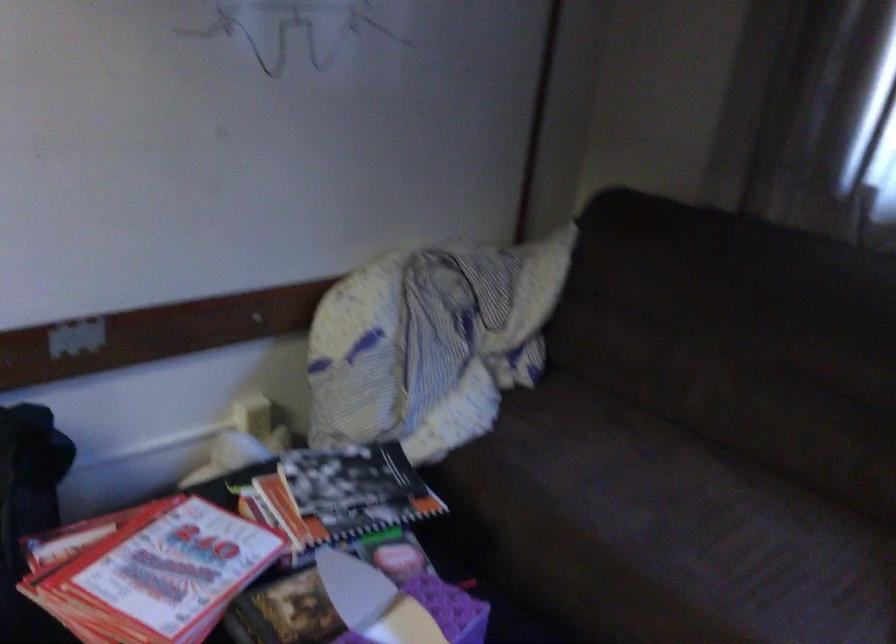
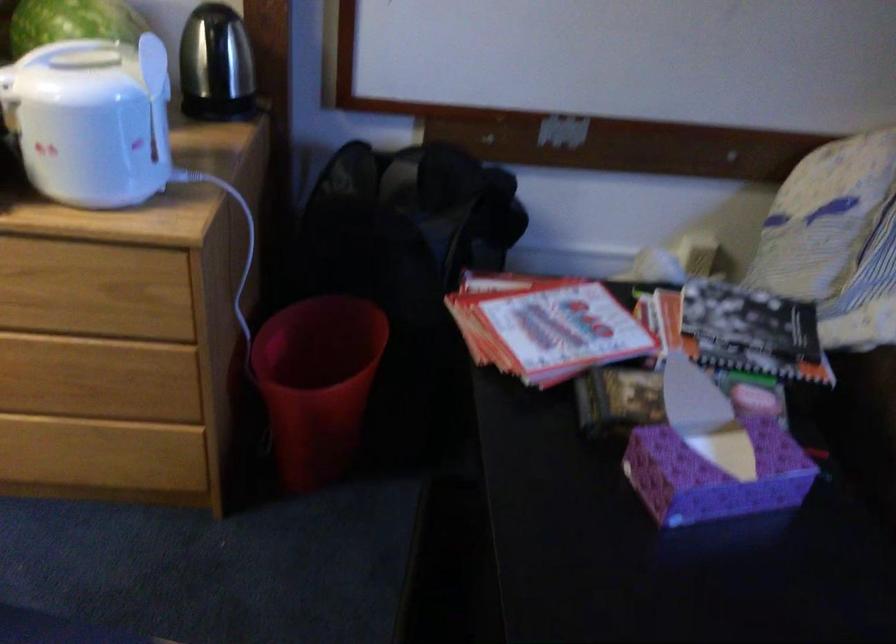
Where in the second image is the point corresponding to pixel 174 573 from the first image?

(545, 326)